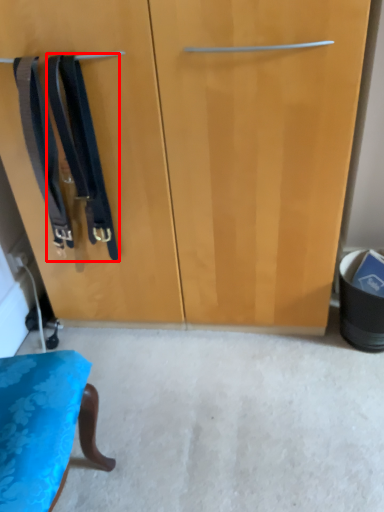
Question: In this image, where is suspenders (annotated by the red box) located relative to suspenders?

Choices:
 (A) right
 (B) left

Answer: (A)